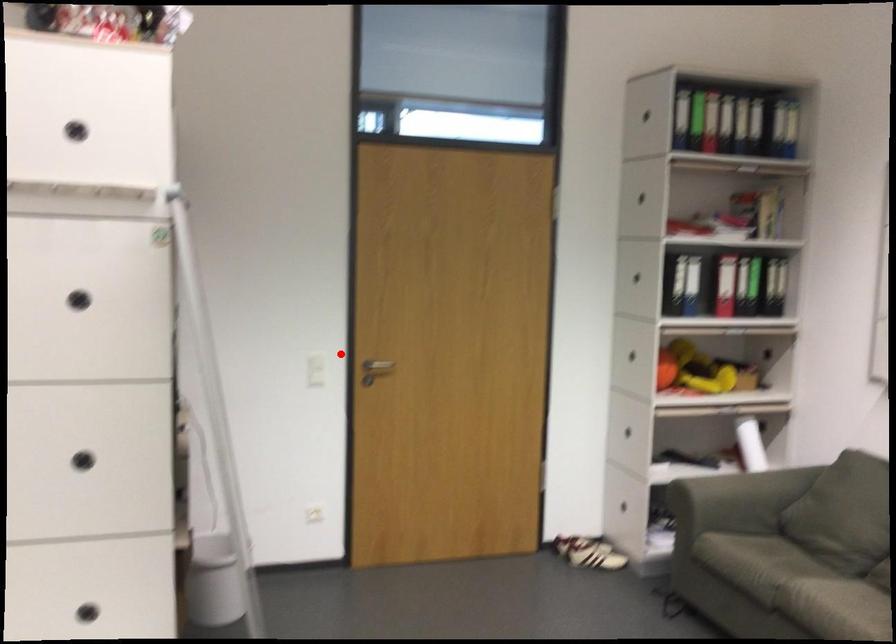
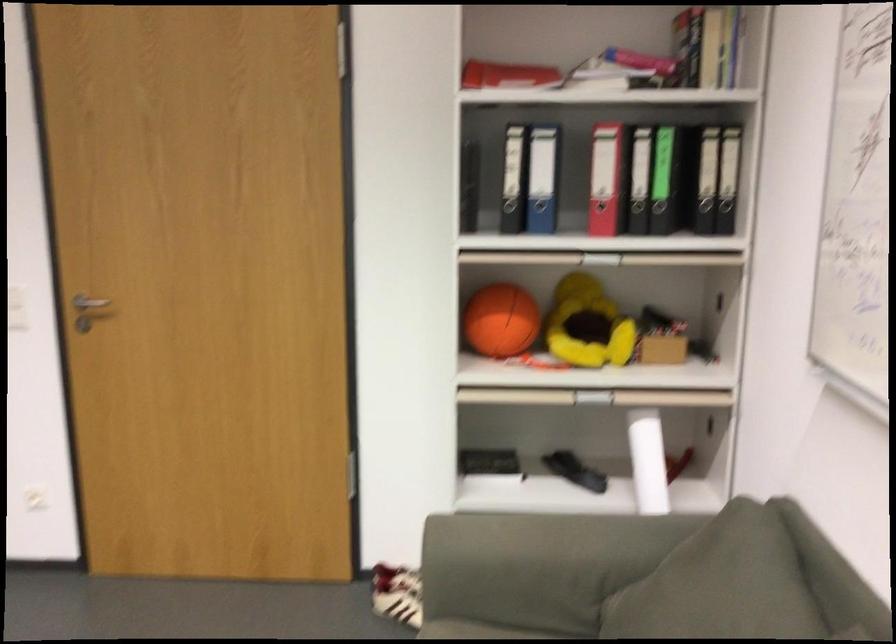
In the second image, find the point that corresponds to the highlighted location in the first image.

(88, 305)